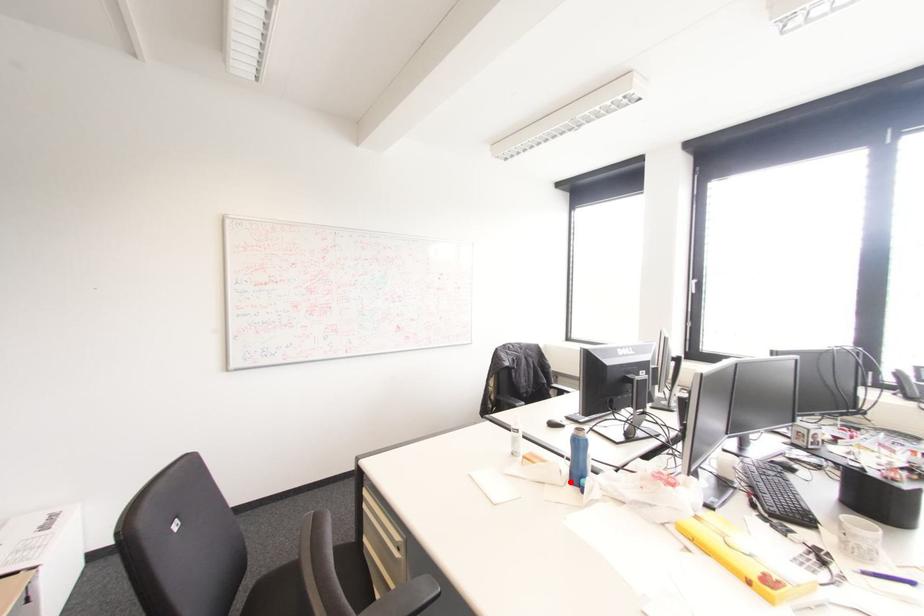
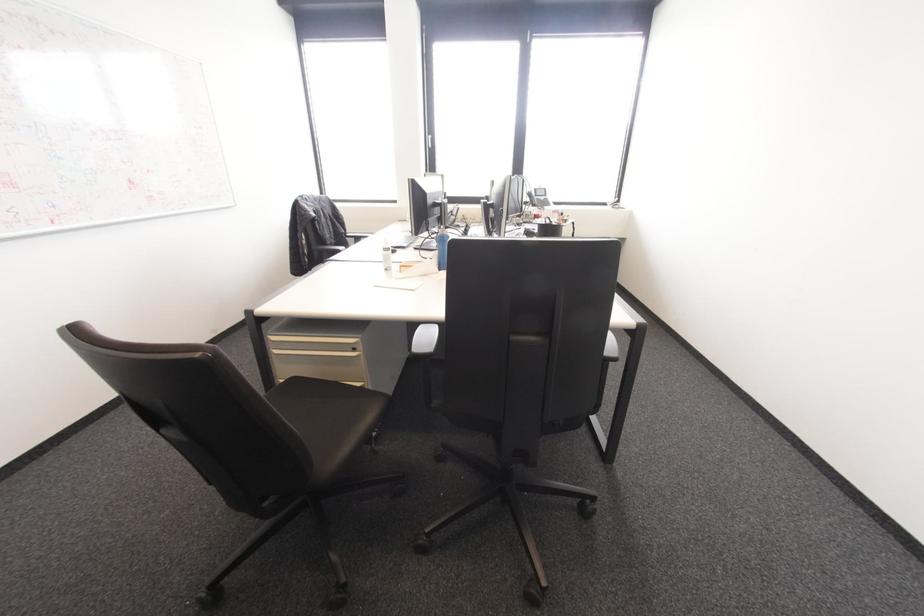
In the second image, find the point that corresponds to the highlighted location in the first image.

(440, 270)